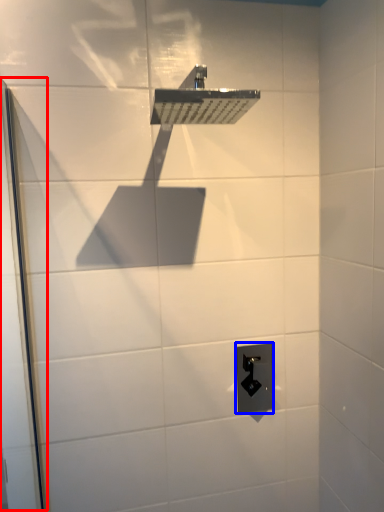
Question: Among these objects, which one is nearest to the camera, screen door (highlighted by a red box) or electric outlet (highlighted by a blue box)?

Choices:
 (A) screen door
 (B) electric outlet

Answer: (A)